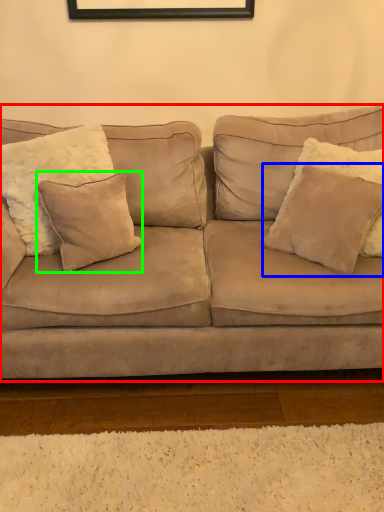
Question: Estimate the real-world distances between objects in this image. Which object is closer to studio couch (highlighted by a red box), pillow (highlighted by a blue box) or pillow (highlighted by a green box)?

Choices:
 (A) pillow
 (B) pillow

Answer: (B)